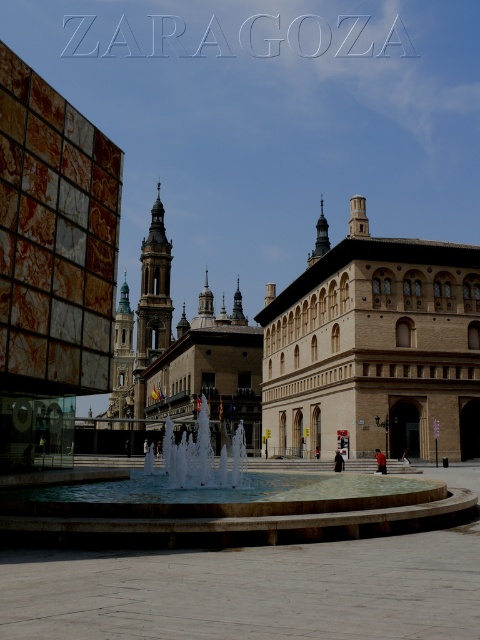
You are a tourist standing in the plaza and want to take a photo of the beige stone building at center and the white glossy fountain at center. Which object should you focus on first if you want to capture both in a single frame without moving your camera?

You should focus on the beige stone building at center first because it is positioned over the white glossy fountain at center, meaning it is closer to you and would be the primary subject in the frame.

You are a tourist standing in the plaza and want to take a photo of the white marble fountain at center without the beige stone building at center blocking the view. Is there a position where you can stand to achieve this?

The white marble fountain at center is behind the beige stone building at center, so you cannot take a photo of the fountain without the building blocking the view from any position in the plaza.